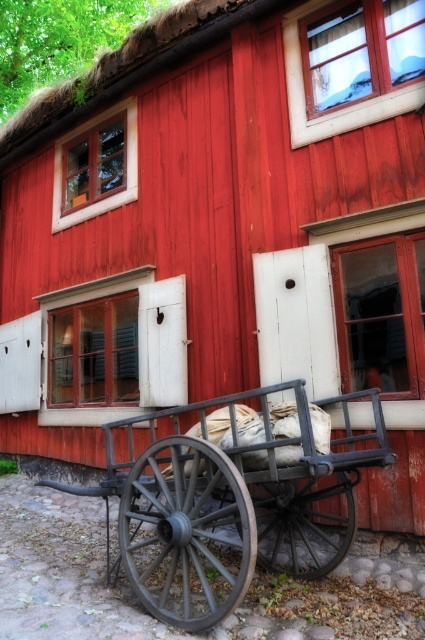
Question: Which point is closer to the camera?

Choices:
 (A) rustic wood wagon at lower center
 (B) dark gray wood wagon wheel at center
 (C) dark gray wooden wagon wheel at lower center

Answer: (A)

Question: Which point is closer to the camera?

Choices:
 (A) (334, 470)
 (B) (221, 566)

Answer: (B)

Question: Observing the image, what is the correct spatial positioning of rustic wood wagon at lower center in reference to dark gray wood wagon wheel at center?

Choices:
 (A) above
 (B) below

Answer: (A)

Question: Does rustic wood wagon at lower center have a smaller size compared to dark gray wood wagon wheel at center?

Choices:
 (A) no
 (B) yes

Answer: (A)

Question: Which point appears farthest from the camera in this image?

Choices:
 (A) (178, 612)
 (B) (221, 472)
 (C) (354, 502)

Answer: (C)

Question: Does rustic wood wagon at lower center have a larger size compared to dark gray wood wagon wheel at center?

Choices:
 (A) yes
 (B) no

Answer: (A)